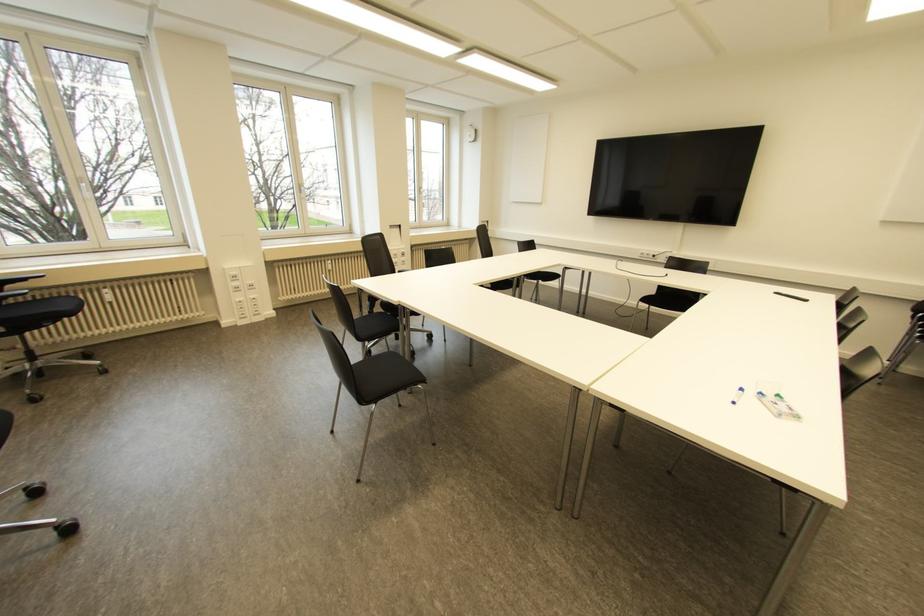
At what (x,y) coordinates should I click in order to perform the action: click on black chair sitting surface. Please return your answer as a coordinate pair (x, y). The width and height of the screenshot is (924, 616). Looking at the image, I should click on (385, 374).